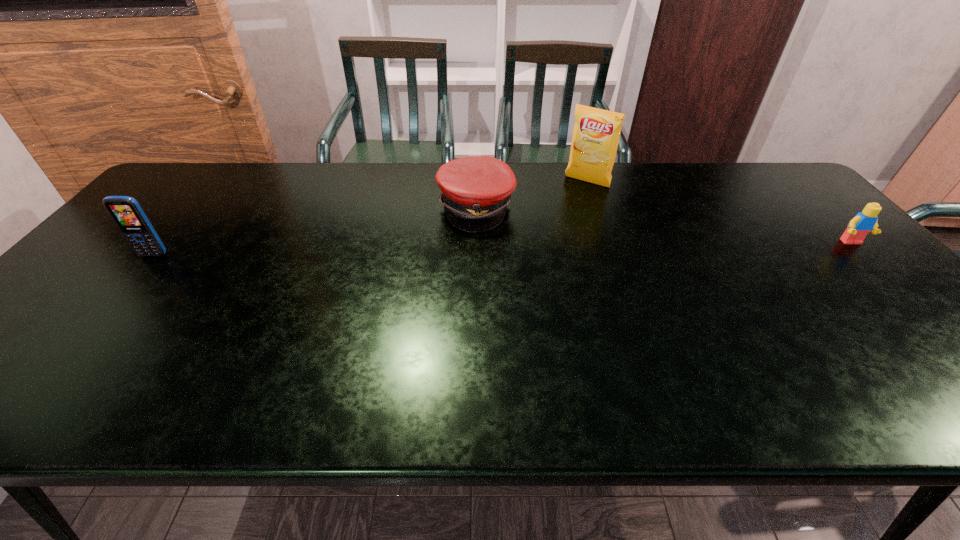
The height and width of the screenshot is (540, 960). Find the location of `cellular telephone`. cellular telephone is located at coordinates (127, 213).

The height and width of the screenshot is (540, 960). In order to click on the nearest object in this screenshot , I will do `click(127, 213)`.

Identify the location of Lego. (865, 221).

Find the location of a particular element. the third farthest object is located at coordinates (865, 221).

Identify the location of cap. Image resolution: width=960 pixels, height=540 pixels. 476,190.

Identify the location of the tallest object. The width and height of the screenshot is (960, 540). (596, 133).

Identify the location of the second object from right to left. (596, 133).

Identify the location of free space located 0.150m on the screen of the nearest object. Image resolution: width=960 pixels, height=540 pixels. (117, 299).

The height and width of the screenshot is (540, 960). In order to click on free space located 0.260m on the front-facing side of the third farthest object in this screenshot , I will do `click(926, 319)`.

You are a GUI agent. You are given a task and a screenshot of the screen. Output one action in this format:
    pyautogui.click(x=<x>, y=<y>)
    Task: Click on the free location located on the front-facing side of the cap
    
    Given the screenshot: What is the action you would take?
    pyautogui.click(x=603, y=274)